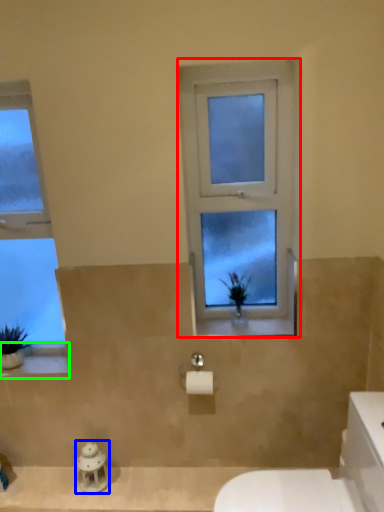
Question: Considering the real-world distances, which object is farthest from window (highlighted by a red box)? figurine (highlighted by a blue box) or window sill (highlighted by a green box)?

Choices:
 (A) figurine
 (B) window sill

Answer: (A)